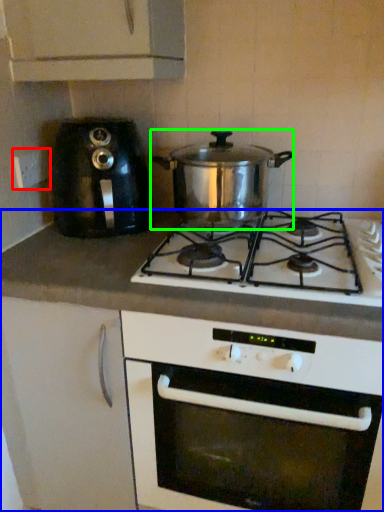
Question: Considering the real-world distances, which object is closest to electric outlet (highlighted by a red box)? counter (highlighted by a blue box) or kitchen appliance (highlighted by a green box).

Choices:
 (A) counter
 (B) kitchen appliance

Answer: (B)